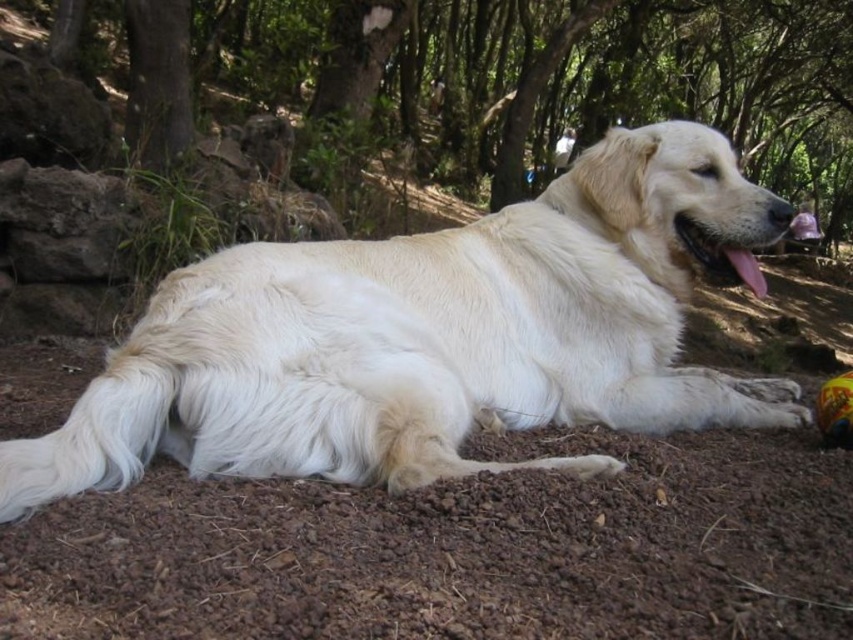
You are a hiker who wants to take a photo of the white fluffy dog at center and the green leafy tree at upper center. The camera you have can capture objects within a 20 feet range. Will both subjects be in the same photo?

The white fluffy dog at center is 22.71 feet away from the green leafy tree at upper center. Since the camera can only capture up to 20 feet, the distance between them exceeds the camera range. Therefore, both subjects cannot be captured in the same photo.

Based on the scene description, where is the white fluffy dog at center located in terms of coordinates?

The white fluffy dog at center is located at coordinates point (433, 337).